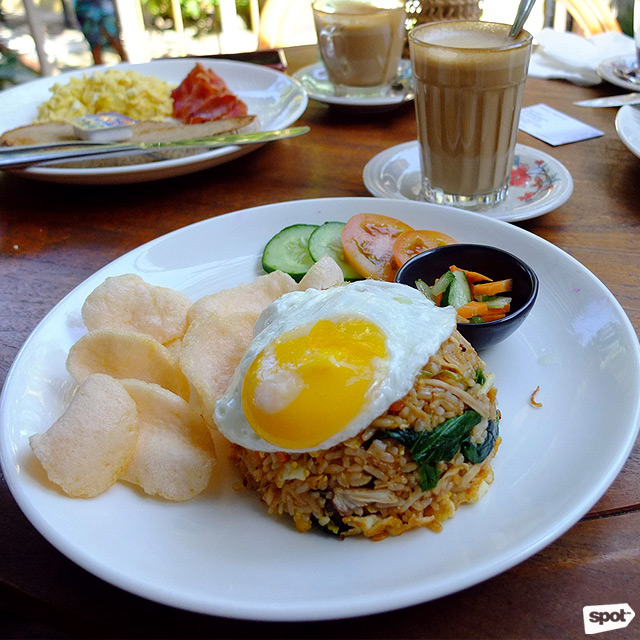
Image resolution: width=640 pixels, height=640 pixels. What are the coordinates of `butter knife` in the screenshot? It's located at (125, 146), (268, 132).